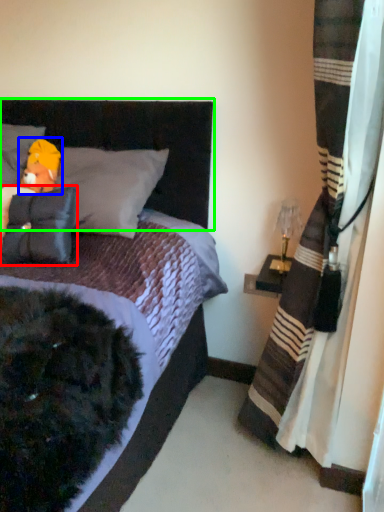
Question: Which object is positioned farthest from pillow (highlighted by a red box)? Select from toy (highlighted by a blue box) and headboard (highlighted by a green box).

Choices:
 (A) toy
 (B) headboard

Answer: (B)